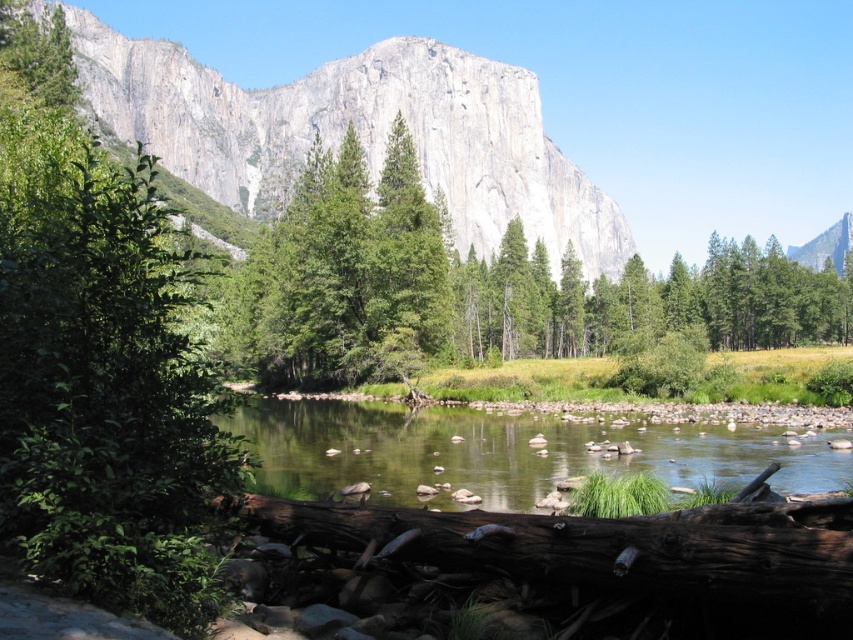
You are standing at the edge of the clear water at center and want to look at the gray rock mountain at upper center. In which direction should you turn your head to see it?

The gray rock mountain at upper center is positioned over clear water at center, so you should look upward to see it.

You are a hiker who wants to cross the river using the brown rough log at lower center. The log is sturdy enough but you need to know if the clear water at center is wide enough for you to step onto the log safely. Can you determine if the log is longer than the width of the river at that point?

The clear water at center has a larger size compared to brown rough log at lower center. Since the log is shorter than the width of the river at that point, it may not be long enough to safely cross by stepping onto it.

You are planning to take a photo of the gray rock mountain at upper center and the clear water at center. Which object will appear larger in the photo?

The gray rock mountain at upper center will appear larger in the photo because it is much taller than the clear water at center.